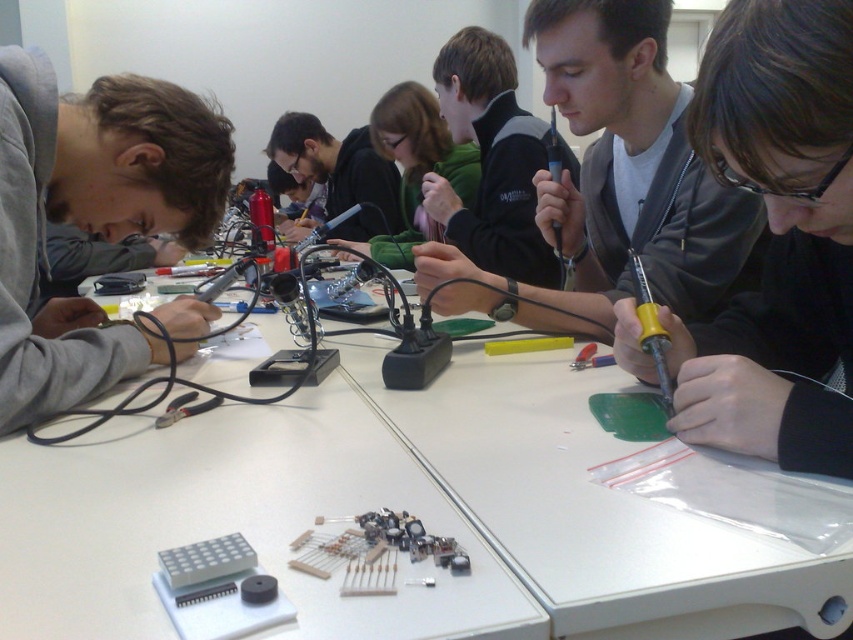
Is matte black screwdriver at center positioned at the back of matte black soldering iron at center?

No, it is not.

Measure the distance between point (x=708, y=86) and camera.

Point (x=708, y=86) and camera are 30.54 inches apart.

You are a GUI agent. You are given a task and a screenshot of the screen. Output one action in this format:
    pyautogui.click(x=<x>, y=<y>)
    Task: Click on the matte black screwdriver at center
    The image size is (853, 640).
    Given the screenshot: What is the action you would take?
    pyautogui.click(x=776, y=237)

Does white plastic table at center appear on the right side of matte black soldering iron at center?

Incorrect, white plastic table at center is not on the right side of matte black soldering iron at center.

Is white plastic table at center above matte black soldering iron at center?

Actually, white plastic table at center is below matte black soldering iron at center.

Where is `white plastic table at center`? Image resolution: width=853 pixels, height=640 pixels. white plastic table at center is located at coordinates (393, 506).

Which is in front, point (553, 93) or point (503, 125)?

Point (553, 93) is in front.

Is point (686, 275) more distant than point (474, 132)?

No, it is not.

Which is behind, point (680, 173) or point (498, 84)?

The point (498, 84) is more distant.

The image size is (853, 640). Find the location of `matte black soldering iron at center`. matte black soldering iron at center is located at coordinates (631, 166).